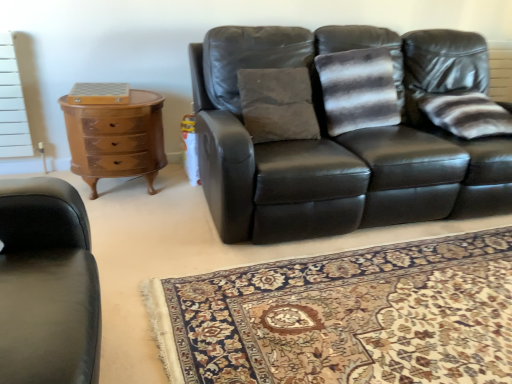
The width and height of the screenshot is (512, 384). I want to click on free space above wooden glossy chest of drawers at left (from a real-world perspective), so click(x=111, y=92).